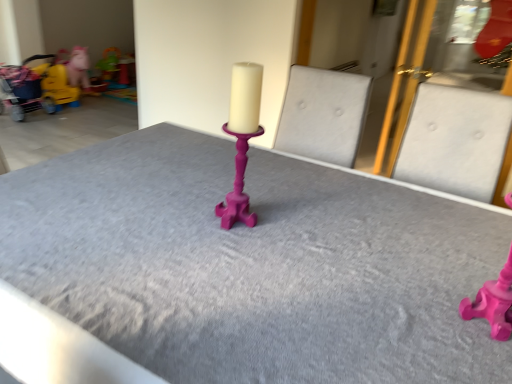
Question: From a real-world perspective, is matte yellow plastic toy at upper left, the first toy from the top, positioned above or below yellow fabric baby carriage at left?

Choices:
 (A) above
 (B) below

Answer: (B)

Question: Considering the positions of matte yellow plastic toy at upper left, positioned as the third toy in front-to-back order, and yellow fabric baby carriage at left in the image, is matte yellow plastic toy at upper left, positioned as the third toy in front-to-back order, taller or shorter than yellow fabric baby carriage at left?

Choices:
 (A) tall
 (B) short

Answer: (B)

Question: Considering the real-world distances, which object is farthest from the matte yellow plastic toy at upper left, the 1th toy positioned from the back?

Choices:
 (A) matte yellow toy at left, which is the 3th toy from right to left
 (B) yellow fabric baby carriage at left
 (C) matte pink candlestick at center
 (D) matte pink candlestick at center, which appears as the first toy when viewed from the right

Answer: (D)

Question: Which of these objects is positioned farthest from the yellow fabric baby carriage at left?

Choices:
 (A) matte pink candlestick at center
 (B) matte yellow toy at left, which is counted as the first toy, starting from the left
 (C) matte pink candlestick at center, which appears as the first toy when viewed from the right
 (D) matte yellow plastic toy at upper left, the 1th toy positioned from the back

Answer: (C)